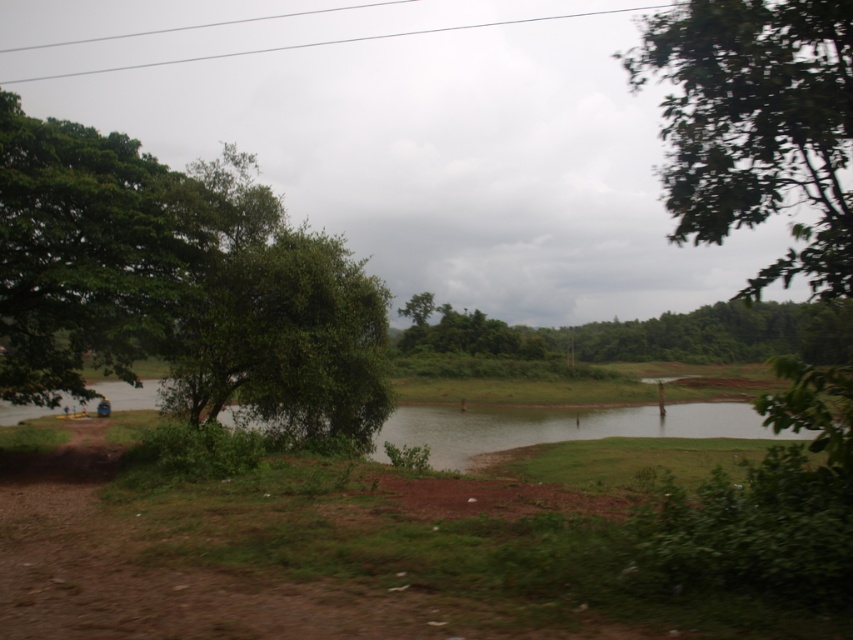
You are standing on the dirt path on the left side of the image and want to walk towards the water. Which direction should you go relative to the green leafy tree at left and the green leafy trees at center?

You should walk towards the water by moving to the right side of the green leafy tree at left and towards the green leafy trees at center since the tree is on the left of the central trees, so moving right would lead you towards the water.

You are standing at the edge of the water in the serene landscape. There are two points marked on the ground, one at coordinates point [722,125] and another at point [445,317]. If you want to reach the point that is closer to you, which coordinate should you head towards?

You should head towards point [722,125] because it is in front of point [445,317], making it closer to your current position at the water edge.